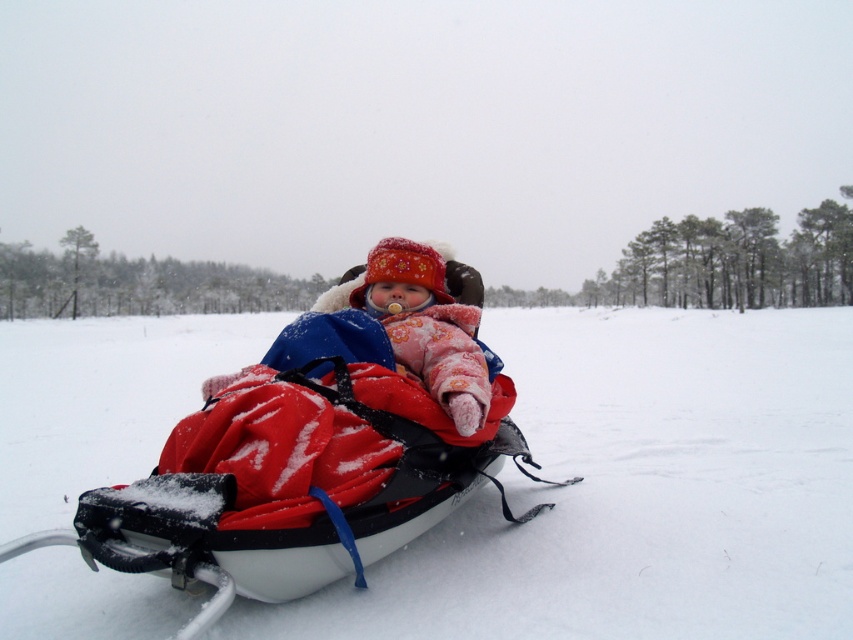
Is red fabric snowmobile at center above fluffy pink snowsuit at center?

Yes, red fabric snowmobile at center is above fluffy pink snowsuit at center.

Locate an element on the screen. red fabric snowmobile at center is located at coordinates (102, 401).